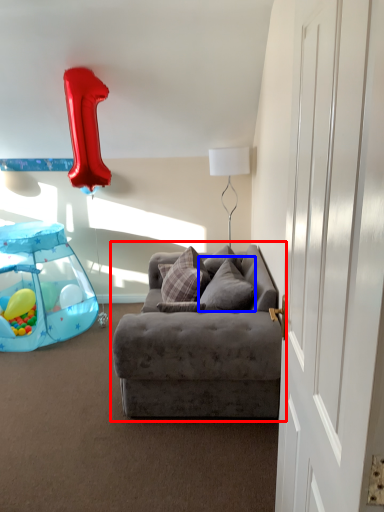
Question: Among these objects, which one is nearest to the camera, studio couch (highlighted by a red box) or pillow (highlighted by a blue box)?

Choices:
 (A) studio couch
 (B) pillow

Answer: (A)